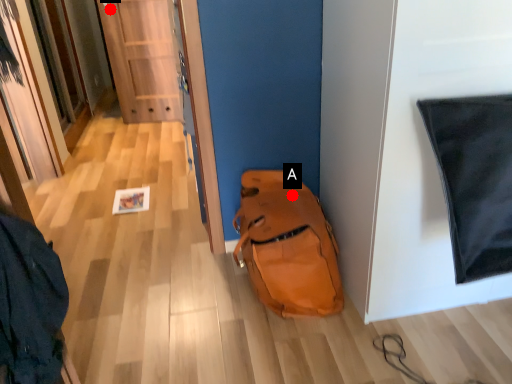
Question: Two points are circled on the image, labeled by A and B beside each circle. Which point is closer to the camera?

Choices:
 (A) A is closer
 (B) B is closer

Answer: (A)